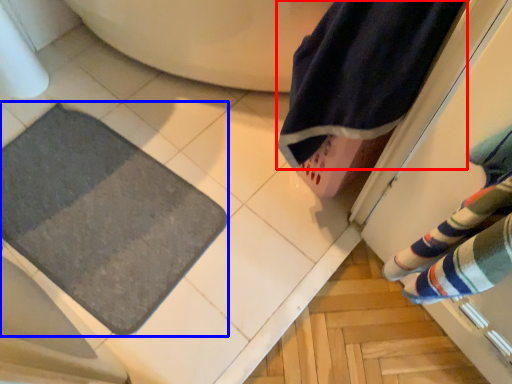
Question: Among these objects, which one is farthest to the camera, beach towel (highlighted by a red box) or bath mat (highlighted by a blue box)?

Choices:
 (A) beach towel
 (B) bath mat

Answer: (B)